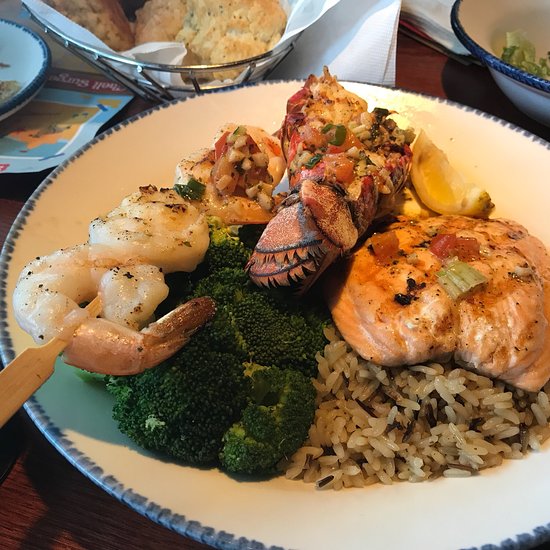
Image resolution: width=550 pixels, height=550 pixels. What are the coordinates of `basket` in the screenshot? It's located at (180, 68).